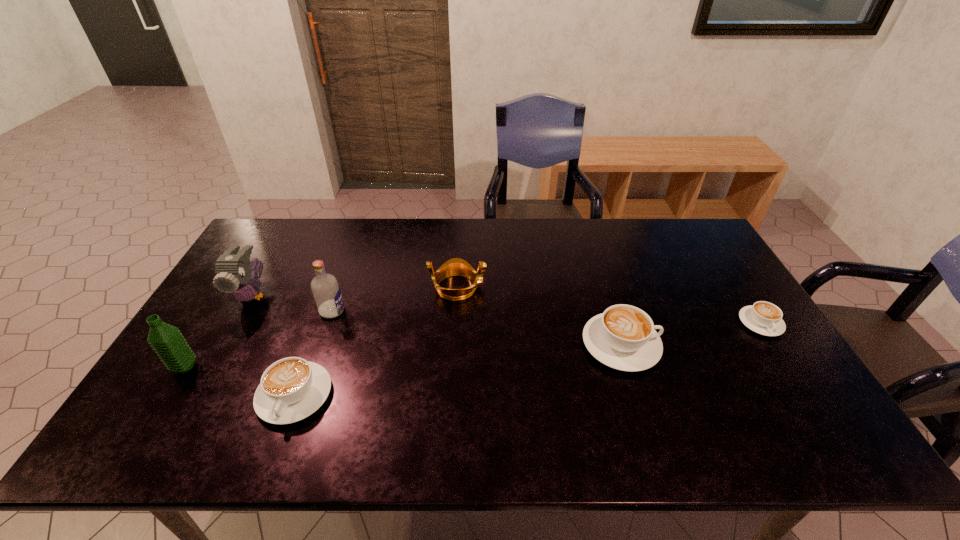
Locate an element on the screen. free space located on the side of the shortest object with the handle is located at coordinates (812, 402).

You are a GUI agent. You are given a task and a screenshot of the screen. Output one action in this format:
    pyautogui.click(x=<x>, y=<y>)
    Task: Click on the free location located 0.340m on the label of the vodka
    This screenshot has height=540, width=960.
    Given the screenshot: What is the action you would take?
    pyautogui.click(x=460, y=311)

You are a GUI agent. You are given a task and a screenshot of the screen. Output one action in this format:
    pyautogui.click(x=<x>, y=<y>)
    Task: Click on the free space located 0.260m at the beak of the second object from left to right
    This screenshot has width=960, height=540.
    Given the screenshot: What is the action you would take?
    pyautogui.click(x=197, y=393)

Find the location of `vacant space situated 0.240m at the front emblem of the tiara`. vacant space situated 0.240m at the front emblem of the tiara is located at coordinates (564, 287).

Identify the location of free space located 0.170m on the right of the water bottle. The height and width of the screenshot is (540, 960). (262, 367).

Locate an element on the screen. This screenshot has width=960, height=540. object that is at the near edge is located at coordinates (291, 389).

Image resolution: width=960 pixels, height=540 pixels. Find the location of `bird positioned at the left edge`. bird positioned at the left edge is located at coordinates (235, 274).

You are a GUI agent. You are given a task and a screenshot of the screen. Output one action in this format:
    pyautogui.click(x=<x>, y=<y>)
    Task: Click on the water bottle that is positioned at the left edge
    The image size is (960, 540).
    Given the screenshot: What is the action you would take?
    pyautogui.click(x=167, y=341)

The image size is (960, 540). I want to click on object at the right edge, so click(765, 318).

This screenshot has width=960, height=540. Find the location of `vacant space at the far edge`. vacant space at the far edge is located at coordinates (443, 227).